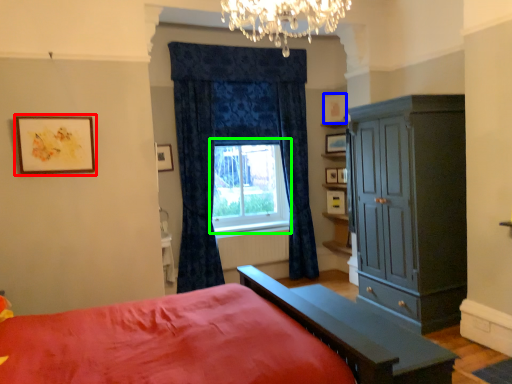
Question: Estimate the real-world distances between objects in this image. Which object is farther from picture frame (highlighted by a red box), picture frame (highlighted by a blue box) or window (highlighted by a green box)?

Choices:
 (A) picture frame
 (B) window

Answer: (A)